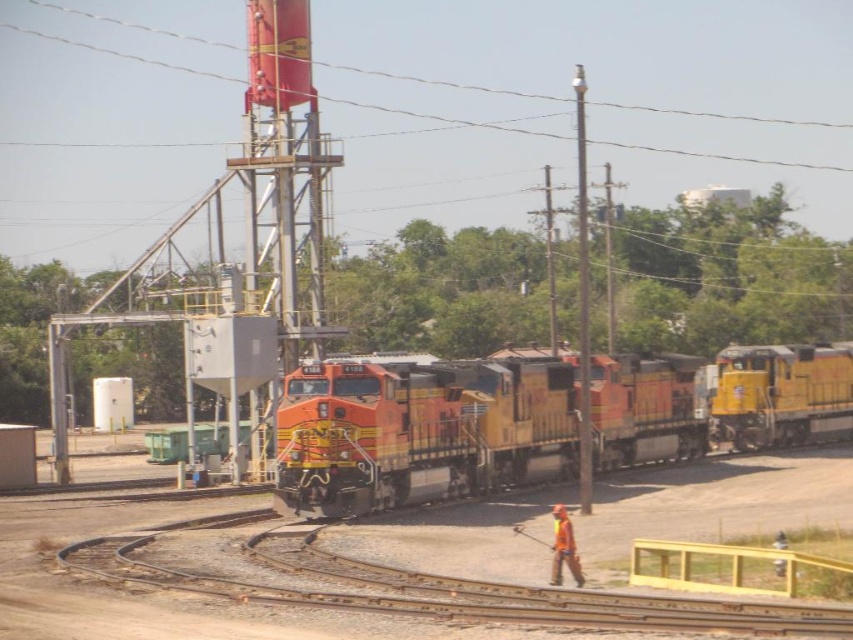
In the scene shown: You are standing at point (569, 518) and want to walk to the worker near the tracks. Is point (451, 392) behind you or in front of you relative to your direction of movement?

Point (451, 392) is behind point (569, 518), so if you are at point (569, 518) facing towards the worker near the tracks, point (451, 392) would be behind you relative to your direction of movement.

You are a railway inspector standing at the point labeled point (x=119, y=52). You need to walk to the nearest locomotive. Which direction should you go?

The metallic wire at upper center is located at point (x=119, y=52). Since the locomotives are in the front of the image, you should walk forward to reach the nearest locomotive.